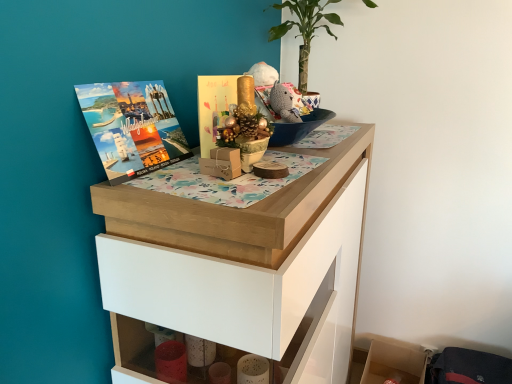
Question: Considering the relative sizes of gold paper card at center, the 1th book cover viewed from the right, and wooden chest of drawers at upper center in the image provided, is gold paper card at center, the 1th book cover viewed from the right, bigger than wooden chest of drawers at upper center?

Choices:
 (A) yes
 (B) no

Answer: (B)

Question: Is wooden chest of drawers at upper center surrounded by gold paper card at center, the 1th book cover viewed from the right?

Choices:
 (A) no
 (B) yes

Answer: (A)

Question: From a real-world perspective, is gold paper card at center, the 1th book cover viewed from the right, on wooden chest of drawers at upper center?

Choices:
 (A) no
 (B) yes

Answer: (B)

Question: From the image's perspective, is gold paper card at center, the 1th book cover viewed from the right, located beneath wooden chest of drawers at upper center?

Choices:
 (A) no
 (B) yes

Answer: (A)

Question: From the image's perspective, would you say gold paper card at center, which is counted as the second book cover, starting from the left, is positioned over wooden chest of drawers at upper center?

Choices:
 (A) no
 (B) yes

Answer: (B)

Question: In the image, is green leafy plant at upper center positioned in front of or behind matte paper book cover at upper left, the 2th book cover in the right-to-left sequence?

Choices:
 (A) front
 (B) behind

Answer: (B)

Question: From the image's perspective, is green leafy plant at upper center located above or below matte paper book cover at upper left, the 2th book cover in the right-to-left sequence?

Choices:
 (A) above
 (B) below

Answer: (A)

Question: Looking at their shapes, would you say green leafy plant at upper center is wider or thinner than matte paper book cover at upper left, the 2th book cover in the right-to-left sequence?

Choices:
 (A) wide
 (B) thin

Answer: (A)

Question: Is point (304, 23) positioned closer to the camera than point (168, 135)?

Choices:
 (A) closer
 (B) farther

Answer: (B)

Question: Is gold paper card at center, which is counted as the second book cover, starting from the left, inside the boundaries of green leafy plant at upper center, or outside?

Choices:
 (A) inside
 (B) outside

Answer: (B)

Question: Is point (236, 87) closer or farther from the camera than point (271, 29)?

Choices:
 (A) farther
 (B) closer

Answer: (B)

Question: Looking at their shapes, would you say gold paper card at center, which is counted as the second book cover, starting from the left, is wider or thinner than green leafy plant at upper center?

Choices:
 (A) wide
 (B) thin

Answer: (B)

Question: Is gold paper card at center, the 1th book cover viewed from the right, bigger or smaller than green leafy plant at upper center?

Choices:
 (A) small
 (B) big

Answer: (A)

Question: Considering the positions of wooden shelf at lower right and wooden chest of drawers at upper center in the image, is wooden shelf at lower right taller or shorter than wooden chest of drawers at upper center?

Choices:
 (A) short
 (B) tall

Answer: (A)

Question: Is wooden shelf at lower right inside or outside of wooden chest of drawers at upper center?

Choices:
 (A) outside
 (B) inside

Answer: (A)